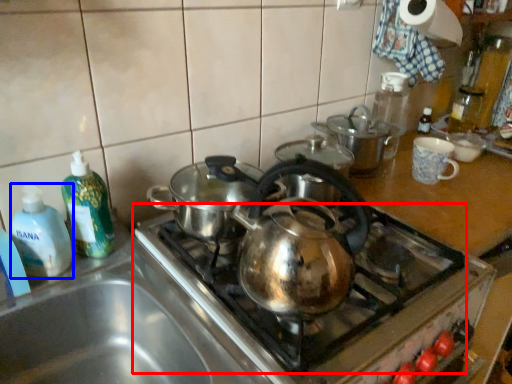
Question: Which of the following is the closest to the observer, gas stove (highlighted by a red box) or bottle (highlighted by a blue box)?

Choices:
 (A) gas stove
 (B) bottle

Answer: (A)